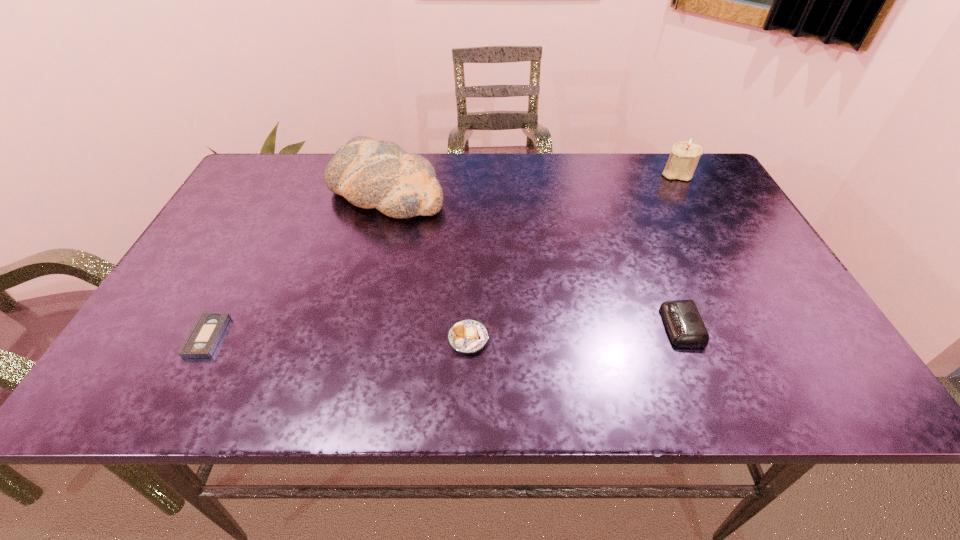
This screenshot has width=960, height=540. In order to click on vacant space located on the display of the second object from right to left in this screenshot , I will do `click(473, 326)`.

The image size is (960, 540). What are the coordinates of `vacant space located on the left of the third object from left to right` in the screenshot? It's located at (267, 339).

The height and width of the screenshot is (540, 960). What are the coordinates of `vacant space situated on the back of the videotape` in the screenshot? It's located at (238, 279).

Identify the location of bread that is at the far edge. (370, 174).

Identify the location of candle_holder positioned at the far edge. (684, 157).

Locate an element on the screen. The image size is (960, 540). object at the left edge is located at coordinates (206, 333).

This screenshot has width=960, height=540. What are the coordinates of `object that is at the right edge` in the screenshot? It's located at (684, 157).

Where is `object that is at the far right corner`? object that is at the far right corner is located at coordinates (684, 157).

In the image, there is a desktop. Identify the location of free region at the far edge. This screenshot has height=540, width=960. (508, 183).

You are a GUI agent. You are given a task and a screenshot of the screen. Output one action in this format:
    pyautogui.click(x=<x>, y=<y>)
    Task: Click on the vacant area at the near edge of the desktop
    This screenshot has height=540, width=960.
    Given the screenshot: What is the action you would take?
    pyautogui.click(x=627, y=380)